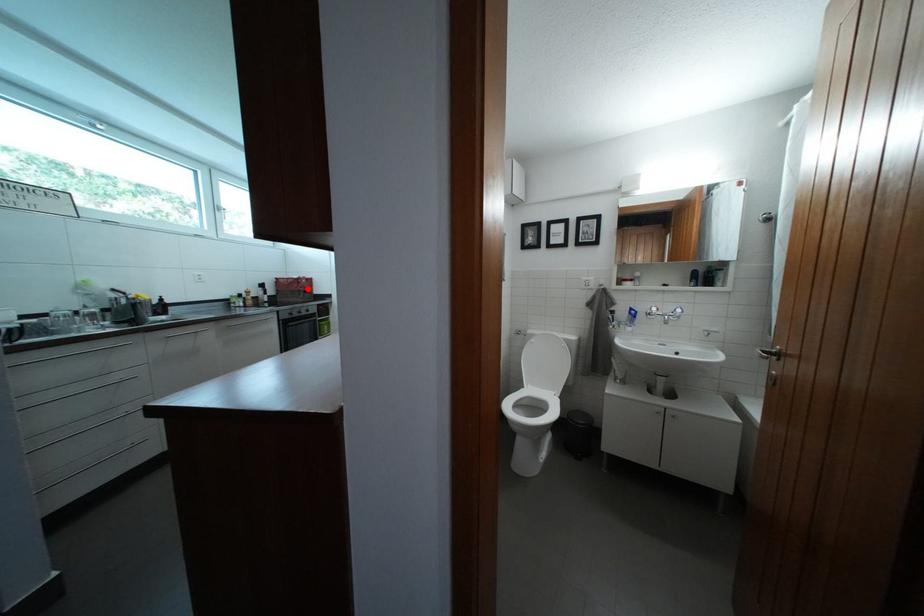
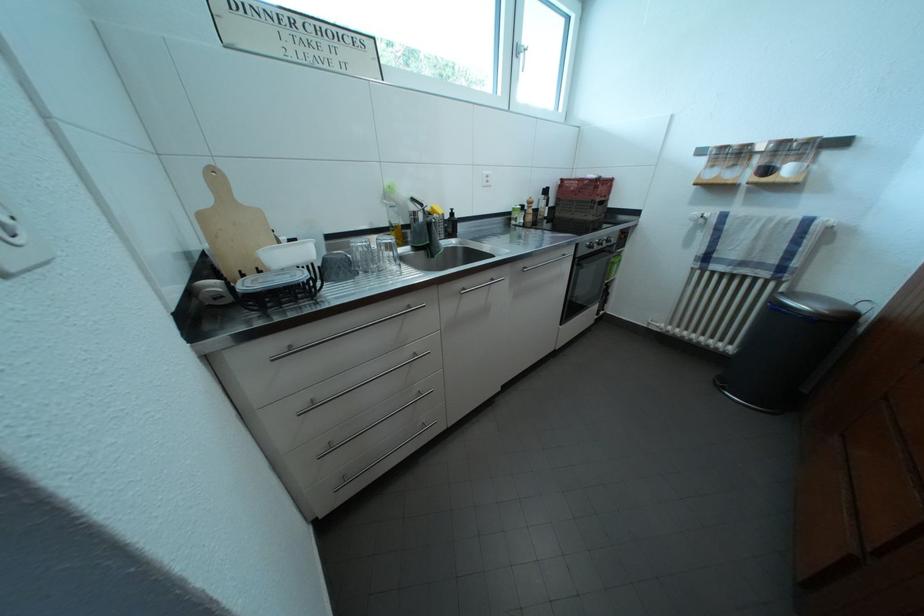
Find the pixel in the second image that matches the highlighted location in the first image.

(605, 193)